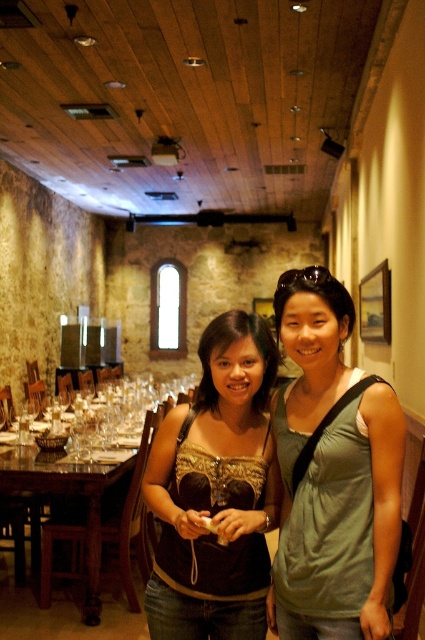
Which is more to the left, brown fabric top at center or wooden polished table at center?

wooden polished table at center

Can you confirm if brown fabric top at center is smaller than wooden polished table at center?

Yes.

Between point (189, 534) and point (90, 612), which one is positioned behind?

Positioned behind is point (90, 612).

You are a GUI agent. You are given a task and a screenshot of the screen. Output one action in this format:
    pyautogui.click(x=<x>, y=<y>)
    Task: Click on the brown fabric top at center
    Image resolution: width=425 pixels, height=640 pixels.
    Given the screenshot: What is the action you would take?
    (x=215, y=492)

Measure the distance between point (397, 506) and camera.

A distance of 1.60 meters exists between point (397, 506) and camera.

At what (x,y) coordinates should I click in order to perform the action: click on green fabric tank top at center. Please return your answer as a coordinate pair (x, y). Looking at the image, I should click on (333, 474).

Is green fabric tank top at center closer to the viewer compared to brown fabric top at center?

Yes.

Where is `green fabric tank top at center`? green fabric tank top at center is located at coordinates (333, 474).